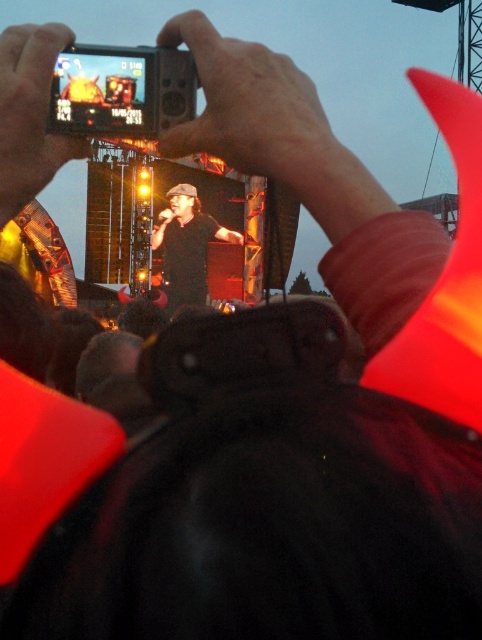
You are at a concert and want to take a photo of the performer on stage. You have a black plastic camera at upper center. Given that the camera is 362.05 feet away from you, can you use it to capture the performer clearly?

The black plastic camera at upper center is 362.05 feet away from the viewer, so it is too far to capture the performer clearly. You need to move closer or use a camera with a zoom lens.

You are taking a photo at the concert and notice the black plastic camera at upper center and the black matte shirt at center. Which object is positioned to the right side?

The black plastic camera at upper center is to the right of the black matte shirt at center.

You are taking a photo at the concert and notice the black plastic camera at upper center and the black matte shirt at center. Which object is closer to you, the photographer?

The black plastic camera at upper center is closer to you because it is in front of the black matte shirt at center.